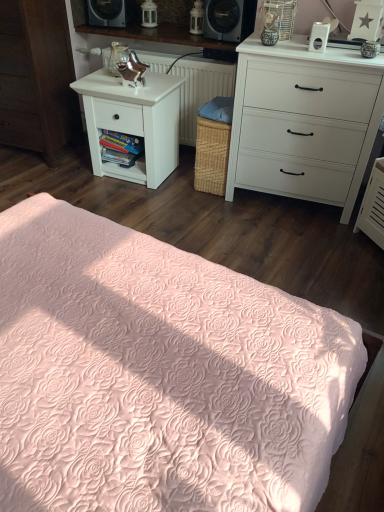
Question: Is point (160, 111) positioned closer to the camera than point (107, 51)?

Choices:
 (A) farther
 (B) closer

Answer: (B)

Question: In the image, is white matte nightstand at left on the left side or the right side of white textured radiator at center?

Choices:
 (A) left
 (B) right

Answer: (A)

Question: Which object is the closest to the pink quilted bedspread at lower center?

Choices:
 (A) white matte nightstand at left
 (B) white wood nightstand at left
 (C) white textured radiator at center
 (D) white matte chest of drawers at upper right

Answer: (D)

Question: Estimate the real-world distances between objects in this image. Which object is closer to the white matte chest of drawers at upper right?

Choices:
 (A) white wood nightstand at left
 (B) pink quilted bedspread at lower center
 (C) white matte nightstand at left
 (D) white textured radiator at center

Answer: (D)